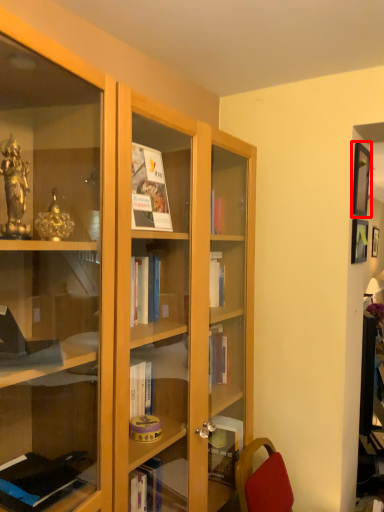
Question: Where is picture frame (annotated by the red box) located in relation to picture frame in the image?

Choices:
 (A) left
 (B) right

Answer: (B)